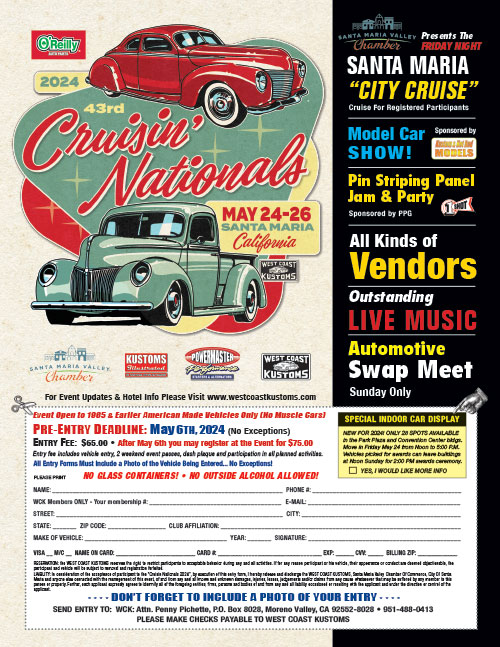
You are a GUI agent. You are given a task and a screenshot of the screen. Output one action in this format:
    pyautogui.click(x=<x>, y=<y>)
    Task: Click on the window
    
    Given the screenshot: What is the action you would take?
    pyautogui.click(x=151, y=226)